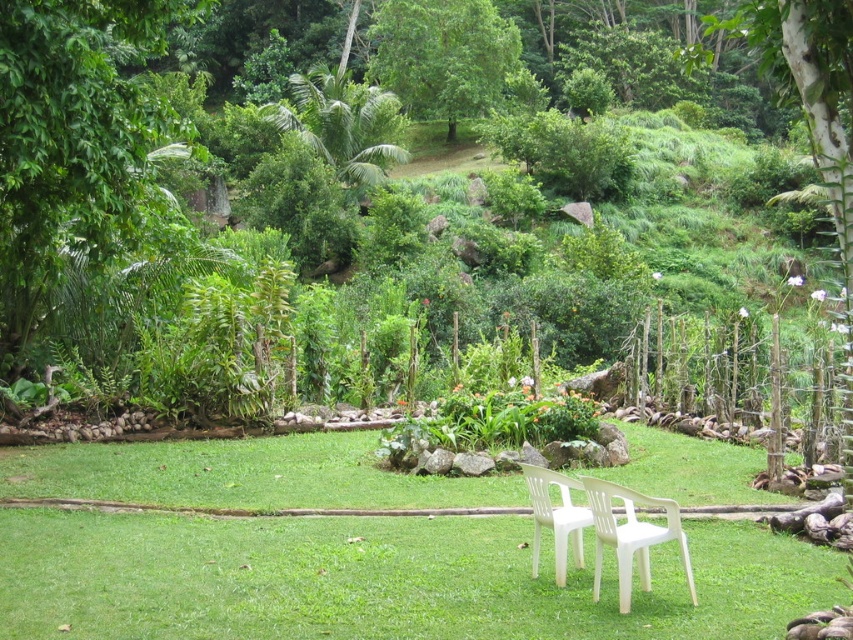
Between green leafy tree at left and white plastic chair at center, which one has more height?

Standing taller between the two is green leafy tree at left.

Where is `green leafy tree at left`? green leafy tree at left is located at coordinates (73, 144).

This screenshot has width=853, height=640. What do you see at coordinates (73, 144) in the screenshot?
I see `green leafy tree at left` at bounding box center [73, 144].

You are a GUI agent. You are given a task and a screenshot of the screen. Output one action in this format:
    pyautogui.click(x=<x>, y=<y>)
    Task: Click on the green leafy tree at left
    
    Given the screenshot: What is the action you would take?
    pyautogui.click(x=73, y=144)

Does green leafy tree at left have a smaller size compared to white plastic chairs at center?

Incorrect, green leafy tree at left is not smaller in size than white plastic chairs at center.

Can you confirm if green leafy tree at left is positioned to the right of white plastic chairs at center?

No, green leafy tree at left is not to the right of white plastic chairs at center.

Is point (161, 125) in front of point (561, 504)?

No, it is behind (561, 504).

The height and width of the screenshot is (640, 853). Identify the location of green leafy tree at left. [73, 144].

Is green leafy tree at upper center wider than white plastic chairs at center?

Indeed, green leafy tree at upper center has a greater width compared to white plastic chairs at center.

Consider the image. Who is lower down, green leafy tree at upper center or white plastic chairs at center?

white plastic chairs at center is below.

Between point (486, 64) and point (570, 532), which one is positioned behind?

The point (486, 64) is more distant.

Locate an element on the screen. green leafy tree at upper center is located at coordinates (444, 56).